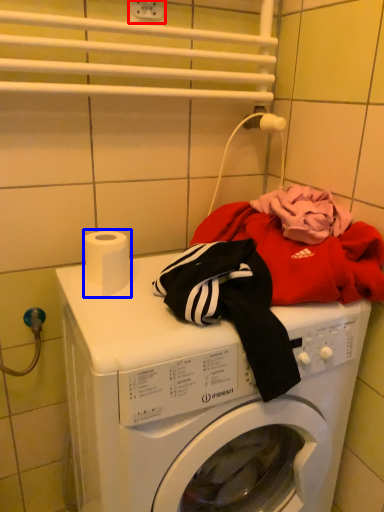
Question: Which object is closer to the camera taking this photo, electric outlet (highlighted by a red box) or toilet paper (highlighted by a blue box)?

Choices:
 (A) electric outlet
 (B) toilet paper

Answer: (B)